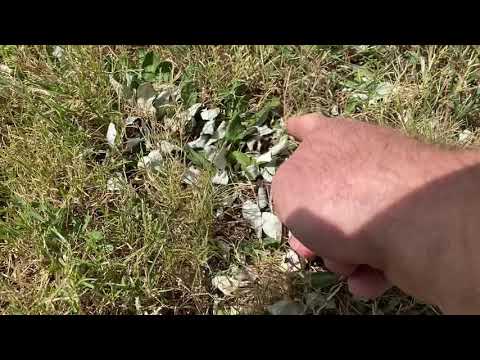
This screenshot has width=480, height=360. What are the coordinates of `frame` in the screenshot? It's located at (131, 339).